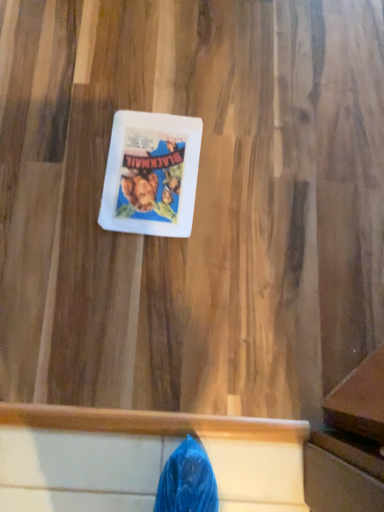
Identify the location of blank space situated above white matte comic book at center (from a real-world perspective). This screenshot has height=512, width=384. (151, 170).